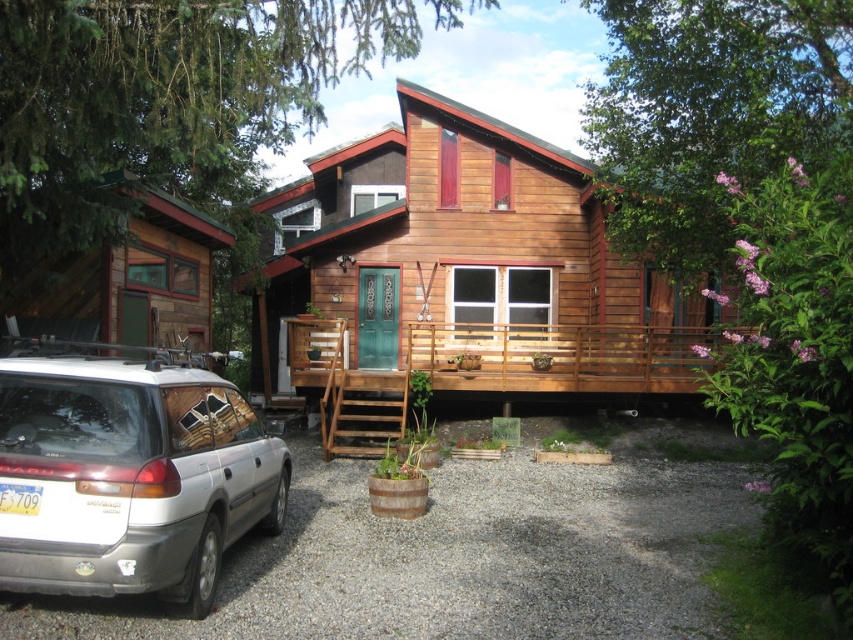
Question: Does silver metallic car at lower left appear under wooden cabin at left?

Choices:
 (A) no
 (B) yes

Answer: (B)

Question: Which of the following is the farthest from the observer?

Choices:
 (A) (509, 522)
 (B) (206, 376)

Answer: (A)

Question: Which object is closer to the camera taking this photo?

Choices:
 (A) wooden cabin at center
 (B) silver metallic car at lower left

Answer: (B)

Question: Is wooden cabin at center thinner than wooden cabin at left?

Choices:
 (A) no
 (B) yes

Answer: (A)

Question: Does wooden cabin at center have a larger size compared to silver metallic car at lower left?

Choices:
 (A) no
 (B) yes

Answer: (B)

Question: Which point is closer to the camera taking this photo?

Choices:
 (A) (165, 381)
 (B) (531, 150)
 (C) (161, 256)

Answer: (A)